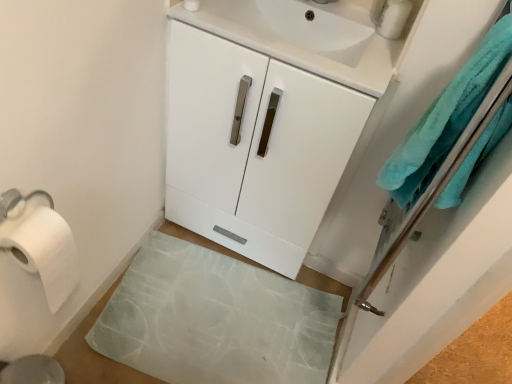
In order to face translucent rubber bath mat at lower center, should I rotate leftwards or rightwards?

You should rotate left by 3.688 degrees.

The image size is (512, 384). Describe the element at coordinates (42, 250) in the screenshot. I see `white paper at left` at that location.

At what (x,y) coordinates should I click in order to perform the action: click on white glossy sink at upper center. Please return your answer as a coordinate pair (x, y). The height and width of the screenshot is (384, 512). Looking at the image, I should click on (x=308, y=37).

Image resolution: width=512 pixels, height=384 pixels. I want to click on translucent rubber bath mat at lower center, so click(x=215, y=319).

Is translucent rubber bath mat at lower center oriented away from white glossy cabinet at center?

Yes, white glossy cabinet at center is at the back of translucent rubber bath mat at lower center.

Can you confirm if translucent rubber bath mat at lower center is thinner than white glossy cabinet at center?

In fact, translucent rubber bath mat at lower center might be wider than white glossy cabinet at center.

Considering the relative sizes of translucent rubber bath mat at lower center and white glossy cabinet at center in the image provided, is translucent rubber bath mat at lower center taller than white glossy cabinet at center?

No.

Considering the sizes of translucent rubber bath mat at lower center and white glossy cabinet at center in the image, is translucent rubber bath mat at lower center bigger or smaller than white glossy cabinet at center?

translucent rubber bath mat at lower center is smaller than white glossy cabinet at center.

The width and height of the screenshot is (512, 384). I want to click on counter top located on the right of white paper at left, so click(308, 37).

Is white glossy sink at upper center positioned far away from white paper at left?

No, white glossy sink at upper center is not far from white paper at left.

From a real-world perspective, between white glossy sink at upper center and white paper at left, who is vertically lower?

white paper at left.

Is white glossy sink at upper center wider or thinner than white paper at left?

white glossy sink at upper center is wider than white paper at left.

Which is less distant, (292, 47) or (468, 157)?

The point (468, 157) is in front.

How different are the orientations of white glossy sink at upper center and teal soft towel at right in degrees?

89 degrees separate the facing orientations of white glossy sink at upper center and teal soft towel at right.

From the image's perspective, is white glossy sink at upper center above teal soft towel at right?

Correct, white glossy sink at upper center appears higher than teal soft towel at right in the image.

Measure the distance between white glossy sink at upper center and teal soft towel at right.

A distance of 15.76 inches exists between white glossy sink at upper center and teal soft towel at right.

From the image's perspective, who appears lower, translucent rubber bath mat at lower center or white glossy sink at upper center?

translucent rubber bath mat at lower center, from the image's perspective.

Visually, is translucent rubber bath mat at lower center positioned to the left or to the right of white glossy sink at upper center?

Based on their positions, translucent rubber bath mat at lower center is located to the left of white glossy sink at upper center.

From the picture: Based on their sizes in the image, would you say translucent rubber bath mat at lower center is bigger or smaller than white glossy sink at upper center?

In the image, translucent rubber bath mat at lower center appears to be smaller than white glossy sink at upper center.

Does point (243, 290) appear closer or farther from the camera than point (276, 41)?

Point (243, 290) is positioned farther from the camera compared to point (276, 41).

Is white glossy cabinet at center outside of metallic silver soap dispenser at upper right?

Yes, white glossy cabinet at center is located beyond the bounds of metallic silver soap dispenser at upper right.

Which of these two, white glossy cabinet at center or metallic silver soap dispenser at upper right, is thinner?

metallic silver soap dispenser at upper right is thinner.

From the image's perspective, is white glossy cabinet at center positioned above or below metallic silver soap dispenser at upper right?

From the image's perspective, white glossy cabinet at center appears below metallic silver soap dispenser at upper right.

From the image's perspective, which is below, white glossy sink at upper center or white glossy cabinet at center?

white glossy cabinet at center appears lower in the image.

In the scene shown: Considering the relative positions of white glossy sink at upper center and white glossy cabinet at center in the image provided, is white glossy sink at upper center to the left or to the right of white glossy cabinet at center?

In the image, white glossy sink at upper center appears on the right side of white glossy cabinet at center.

How many degrees apart are the facing directions of white glossy sink at upper center and white glossy cabinet at center?

The angular difference between white glossy sink at upper center and white glossy cabinet at center is 0.492 degrees.

Looking at their sizes, would you say teal soft towel at right is wider or thinner than metallic silver soap dispenser at upper right?

Considering their sizes, teal soft towel at right looks broader than metallic silver soap dispenser at upper right.

From the image's perspective, is teal soft towel at right located above metallic silver soap dispenser at upper right?

Incorrect, from the image's perspective, teal soft towel at right is lower than metallic silver soap dispenser at upper right.

Is point (451, 197) positioned before point (391, 21)?

Yes, it is.

Is teal soft towel at right positioned far away from metallic silver soap dispenser at upper right?

teal soft towel at right is actually quite close to metallic silver soap dispenser at upper right.

In order to click on cabinetry above the translucent rubber bath mat at lower center (from the image's perspective) in this screenshot , I will do `click(253, 147)`.

Identify the location of toilet paper below the white glossy sink at upper center (from the image's perspective). Image resolution: width=512 pixels, height=384 pixels. (42, 250).

Looking at the image, which one is located closer to metallic silver soap dispenser at upper right, translucent rubber bath mat at lower center or white paper at left?

translucent rubber bath mat at lower center is positioned closer to the anchor metallic silver soap dispenser at upper right.

Looking at the image, which one is located closer to white glossy cabinet at center, white glossy sink at upper center or metallic silver soap dispenser at upper right?

white glossy sink at upper center is closer to white glossy cabinet at center.

From the image, which object appears to be nearer to metallic silver soap dispenser at upper right, white glossy cabinet at center or white paper at left?

white glossy cabinet at center.

Which object lies nearer to the anchor point white glossy sink at upper center, white glossy cabinet at center or white paper at left?

white glossy cabinet at center lies closer to white glossy sink at upper center than the other object.

When comparing their distances from translucent rubber bath mat at lower center, does teal soft towel at right or metallic silver soap dispenser at upper right seem further?

metallic silver soap dispenser at upper right is further to translucent rubber bath mat at lower center.

Based on their spatial positions, is teal soft towel at right or white paper at left closer to translucent rubber bath mat at lower center?

Among the two, white paper at left is located nearer to translucent rubber bath mat at lower center.

Estimate the real-world distances between objects in this image. Which object is closer to translucent rubber bath mat at lower center, metallic silver soap dispenser at upper right or white glossy sink at upper center?

Answer: white glossy sink at upper center is closer to translucent rubber bath mat at lower center.

Which object lies further to the anchor point white glossy cabinet at center, teal soft towel at right or translucent rubber bath mat at lower center?

Based on the image, teal soft towel at right appears to be further to white glossy cabinet at center.

Locate an element on the screen. The width and height of the screenshot is (512, 384). counter top between teal soft towel at right and white glossy cabinet at center from front to back is located at coordinates (308, 37).

At what (x,y) coordinates should I click in order to perform the action: click on bath towel between white glossy cabinet at center and translucent rubber bath mat at lower center from top to bottom. Please return your answer as a coordinate pair (x, y). Looking at the image, I should click on (445, 119).

You are a GUI agent. You are given a task and a screenshot of the screen. Output one action in this format:
    pyautogui.click(x=<x>, y=<y>)
    Task: Click on the counter top that lies between metallic silver soap dispenser at upper right and translucent rubber bath mat at lower center from top to bottom
    
    Given the screenshot: What is the action you would take?
    pyautogui.click(x=308, y=37)

Identify the location of counter top located between white paper at left and teal soft towel at right in the left-right direction. (308, 37).